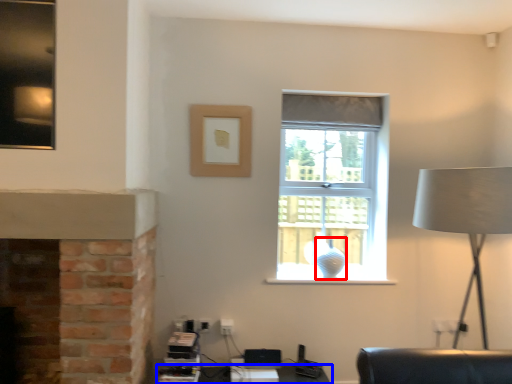
Question: Among these objects, which one is farthest to the camera, glass vase (highlighted by a red box) or table (highlighted by a blue box)?

Choices:
 (A) glass vase
 (B) table

Answer: (A)